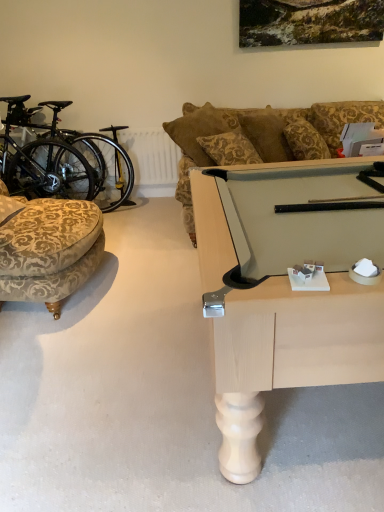
At what (x,y) coordinates should I click in order to perform the action: click on black matte bicycle at left. Please return your answer as a coordinate pair (x, y). Looking at the image, I should click on (43, 159).

Describe the element at coordinates (43, 159) in the screenshot. I see `black matte bicycle at left` at that location.

What do you see at coordinates (47, 248) in the screenshot? The height and width of the screenshot is (512, 384). I see `velvet-patterned ottoman at left` at bounding box center [47, 248].

Where is `velvet-patterned ottoman at left`? Image resolution: width=384 pixels, height=512 pixels. velvet-patterned ottoman at left is located at coordinates (47, 248).

Image resolution: width=384 pixels, height=512 pixels. Find the location of `black matte bicycle at left`. black matte bicycle at left is located at coordinates [43, 159].

Does black matte bicycle at left appear on the left side of velvet-patterned ottoman at left?

Correct, you'll find black matte bicycle at left to the left of velvet-patterned ottoman at left.

Considering the relative positions of black matte bicycle at left and velvet-patterned ottoman at left in the image provided, is black matte bicycle at left in front of velvet-patterned ottoman at left?

No, the depth of black matte bicycle at left is greater than that of velvet-patterned ottoman at left.

Which is closer, (7, 168) or (54, 236)?

The point (54, 236) is more forward.

From the image's perspective, would you say black matte bicycle at left is positioned over velvet-patterned ottoman at left?

Yes, from the image's perspective, black matte bicycle at left is over velvet-patterned ottoman at left.

From a real-world perspective, does black matte bicycle at left sit lower than velvet-patterned ottoman at left?

No.

Between black matte bicycle at left and velvet-patterned ottoman at left, which one has smaller width?

Thinner between the two is black matte bicycle at left.

Considering the sizes of objects black matte bicycle at left and velvet-patterned ottoman at left in the image provided, who is taller, black matte bicycle at left or velvet-patterned ottoman at left?

black matte bicycle at left is taller.

Is black matte bicycle at left bigger or smaller than velvet-patterned ottoman at left?

black matte bicycle at left is bigger than velvet-patterned ottoman at left.

Is black matte bicycle at left inside the boundaries of velvet-patterned ottoman at left, or outside?

black matte bicycle at left cannot be found inside velvet-patterned ottoman at left.

Based on the photo, is black matte bicycle at left with velvet-patterned ottoman at left?

No, black matte bicycle at left is not next to velvet-patterned ottoman at left.

From the picture: Is black matte bicycle at left facing away from velvet-patterned ottoman at left?

No, black matte bicycle at left's orientation is not away from velvet-patterned ottoman at left.

How much distance is there between black matte bicycle at left and velvet-patterned ottoman at left?

A distance of 1.12 meters exists between black matte bicycle at left and velvet-patterned ottoman at left.

Find the location of a particular element. chair in front of the black matte bicycle at left is located at coordinates (47, 248).

Looking at this image, is velvet-patterned ottoman at left to the left or to the right of black matte bicycle at left in the image?

A: Clearly, velvet-patterned ottoman at left is on the right of black matte bicycle at left in the image.

Which object is further away from the camera, velvet-patterned ottoman at left or black matte bicycle at left?

black matte bicycle at left is further away from the camera.

Considering the points (13, 283) and (45, 157), which point is in front, point (13, 283) or point (45, 157)?

The point (13, 283) is in front.

From the image's perspective, relative to black matte bicycle at left, is velvet-patterned ottoman at left above or below?

From the image's perspective, velvet-patterned ottoman at left appears below black matte bicycle at left.

From a real-world perspective, between velvet-patterned ottoman at left and black matte bicycle at left, who is vertically higher?

black matte bicycle at left.

Between velvet-patterned ottoman at left and black matte bicycle at left, which one has larger width?

Wider between the two is velvet-patterned ottoman at left.

Considering the sizes of objects velvet-patterned ottoman at left and black matte bicycle at left in the image provided, who is shorter, velvet-patterned ottoman at left or black matte bicycle at left?

With less height is velvet-patterned ottoman at left.

Does velvet-patterned ottoman at left have a smaller size compared to black matte bicycle at left?

Indeed, velvet-patterned ottoman at left has a smaller size compared to black matte bicycle at left.

Is black matte bicycle at left completely or partially inside velvet-patterned ottoman at left?

No, black matte bicycle at left is not surrounded by velvet-patterned ottoman at left.

Is velvet-patterned ottoman at left in contact with black matte bicycle at left?

velvet-patterned ottoman at left and black matte bicycle at left are clearly separated.

Is velvet-patterned ottoman at left turned away from black matte bicycle at left?

That's not correct — velvet-patterned ottoman at left is not looking away from black matte bicycle at left.

How different are the orientations of velvet-patterned ottoman at left and black matte bicycle at left in degrees?

The facing directions of velvet-patterned ottoman at left and black matte bicycle at left are 81.1 degrees apart.

Measure the distance from velvet-patterned ottoman at left to black matte bicycle at left.

The distance of velvet-patterned ottoman at left from black matte bicycle at left is 3.69 feet.

Locate an element on the screen. Image resolution: width=384 pixels, height=512 pixels. chair lying in front of the black matte bicycle at left is located at coordinates (47, 248).

Find the location of a particular element. bicycle located on the left of velvet-patterned ottoman at left is located at coordinates (43, 159).

I want to click on chair in front of the black matte bicycle at left, so 47,248.